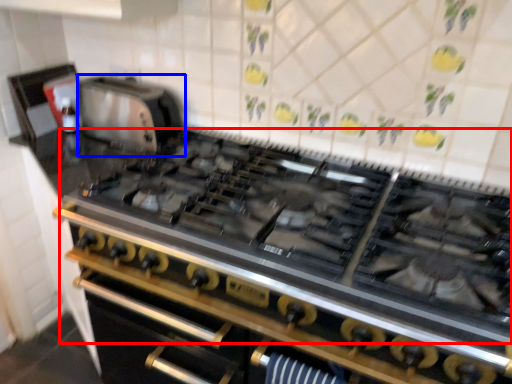
Question: Which of the following is the closest to the observer, gas stove (highlighted by a red box) or appliance (highlighted by a blue box)?

Choices:
 (A) gas stove
 (B) appliance

Answer: (A)